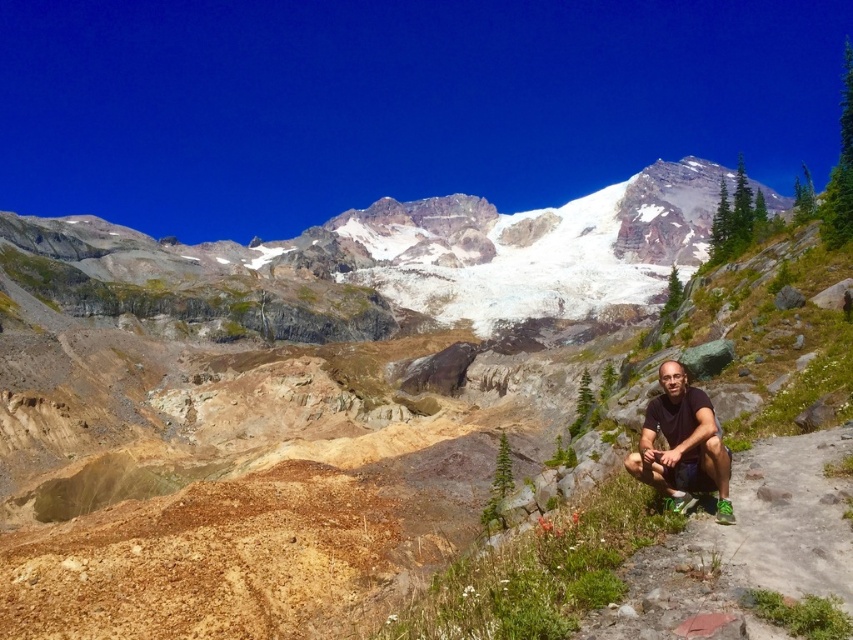
Who is higher up, white rocky mountain at upper center or matte black shorts at lower right?

white rocky mountain at upper center is higher up.

Describe the element at coordinates (437, 250) in the screenshot. I see `white rocky mountain at upper center` at that location.

I want to click on white rocky mountain at upper center, so click(437, 250).